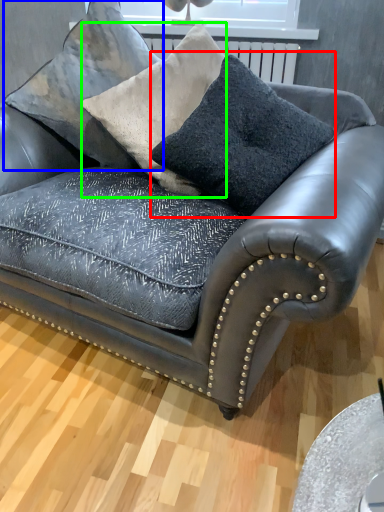
Question: Considering the real-world distances, which object is closest to throw pillow (highlighted by a red box)? pillow (highlighted by a blue box) or throw pillow (highlighted by a green box).

Choices:
 (A) pillow
 (B) throw pillow

Answer: (B)